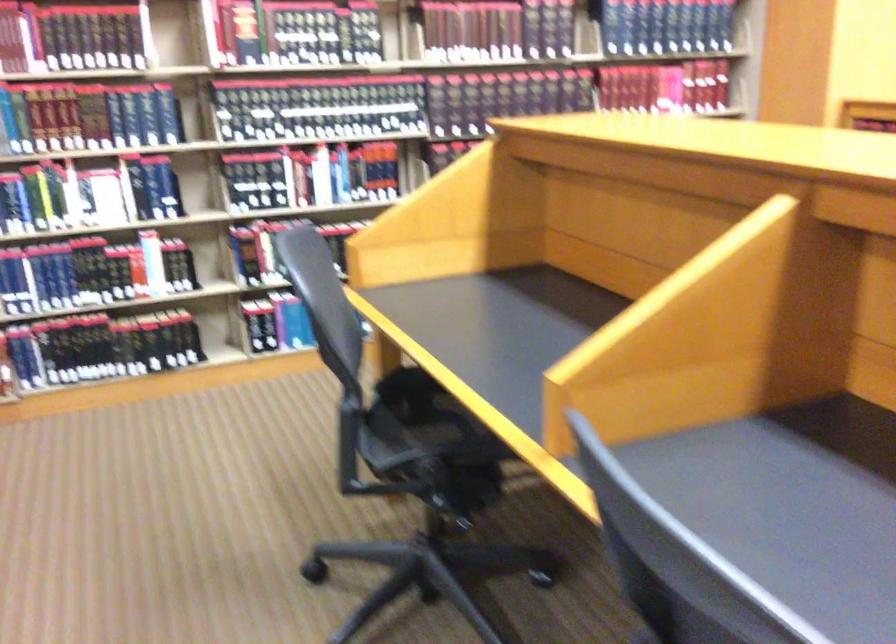
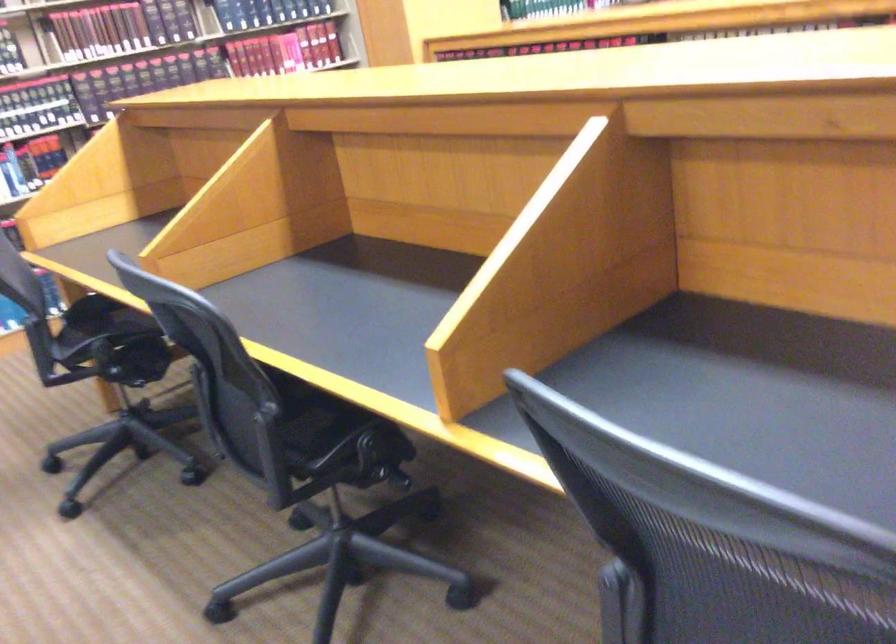
In the second image, find the point that corresponds to point (547, 88) in the first image.

(177, 62)